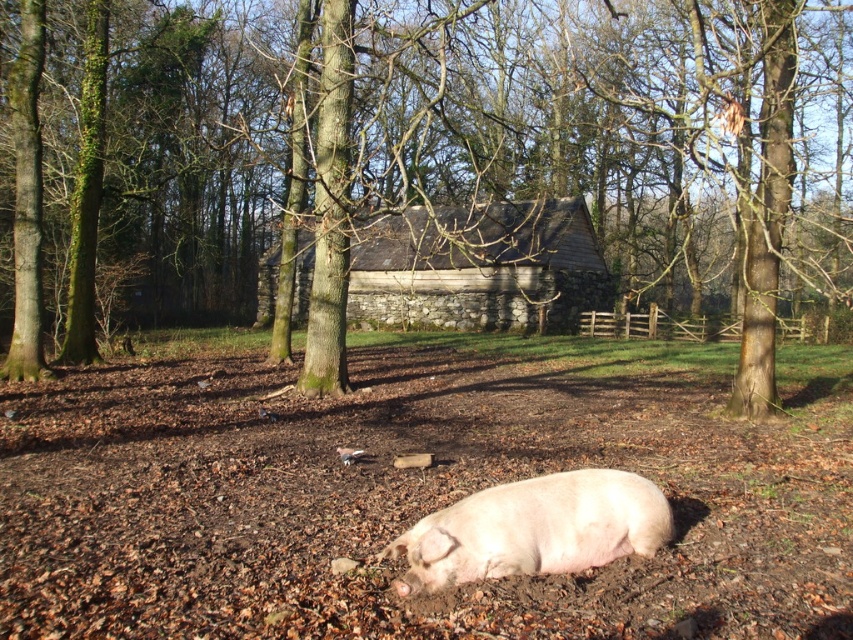
Question: In this image, where is brown textured tree at center located relative to pink smooth pig at lower center?

Choices:
 (A) right
 (B) left

Answer: (A)

Question: Among these objects, which one is nearest to the camera?

Choices:
 (A) brown soil at center
 (B) brown textured tree at center

Answer: (A)

Question: Which point appears closest to the camera in this image?

Choices:
 (A) (26, 406)
 (B) (496, 564)

Answer: (B)

Question: Can you confirm if brown textured tree at center is wider than brown soil at center?

Choices:
 (A) no
 (B) yes

Answer: (B)

Question: Can you confirm if brown soil at center is positioned to the right of pink smooth pig at lower center?

Choices:
 (A) yes
 (B) no

Answer: (A)

Question: Among these points, which one is farthest from the camera?

Choices:
 (A) (697, 560)
 (B) (416, 579)
 (C) (791, 192)

Answer: (C)